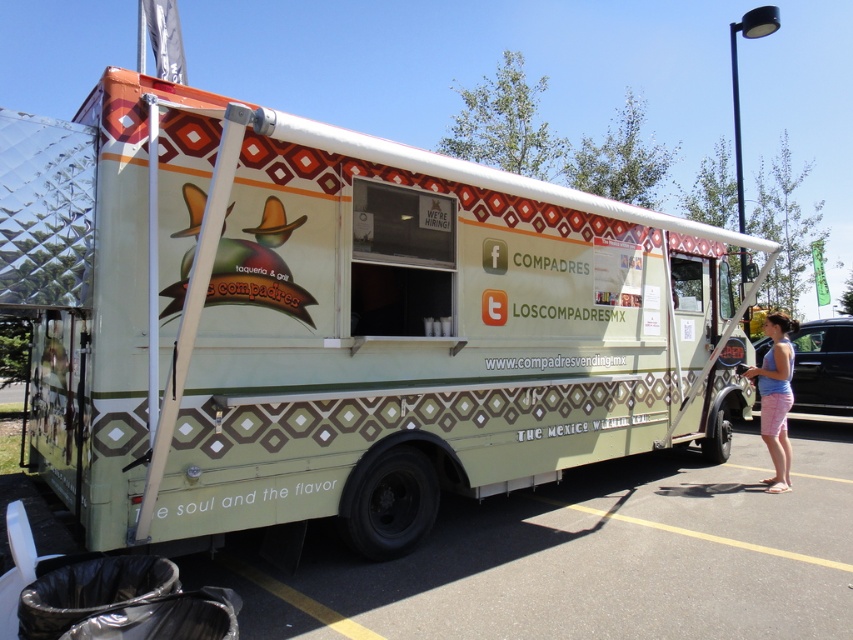
Question: Is matte green food truck at center below green asphalt at lower center?

Choices:
 (A) yes
 (B) no

Answer: (B)

Question: Which point appears closest to the camera in this image?

Choices:
 (A) (451, 289)
 (B) (788, 349)

Answer: (A)

Question: Is matte green food truck at center further to camera compared to green asphalt at lower center?

Choices:
 (A) yes
 (B) no

Answer: (B)

Question: Among these points, which one is nearest to the camera?

Choices:
 (A) coord(532,576)
 (B) coord(596,275)

Answer: (A)

Question: Which of the following is the closest to the observer?

Choices:
 (A) pink cotton shorts at lower right
 (B) green asphalt at lower center
 (C) matte green food truck at center

Answer: (C)

Question: Can you confirm if matte green food truck at center is thinner than green asphalt at lower center?

Choices:
 (A) no
 (B) yes

Answer: (A)